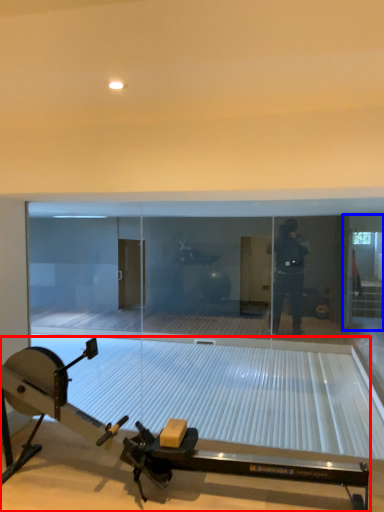
Question: Which of the following is the farthest to the observer, sport equipment (highlighted by a red box) or glass door (highlighted by a blue box)?

Choices:
 (A) sport equipment
 (B) glass door

Answer: (B)